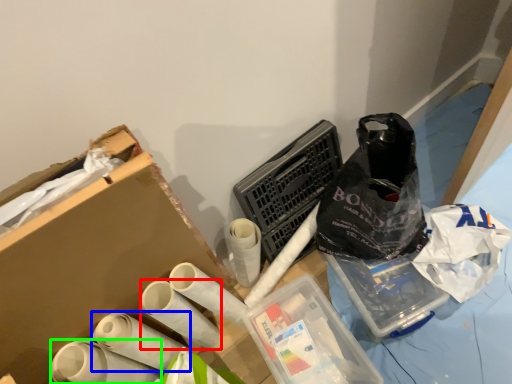
Question: Based on their relative distances, which object is nearer to toilet paper (highlighted by a red box)? Choose from toilet paper (highlighted by a blue box) and toilet paper (highlighted by a green box).

Choices:
 (A) toilet paper
 (B) toilet paper

Answer: (A)